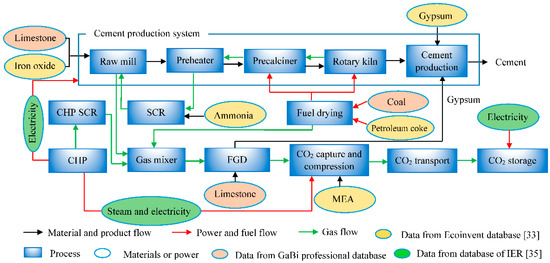
Image resolution: width=550 pixels, height=263 pixels. I want to click on bracket, so click(x=524, y=235), click(x=538, y=233), click(x=540, y=255), click(x=526, y=254).